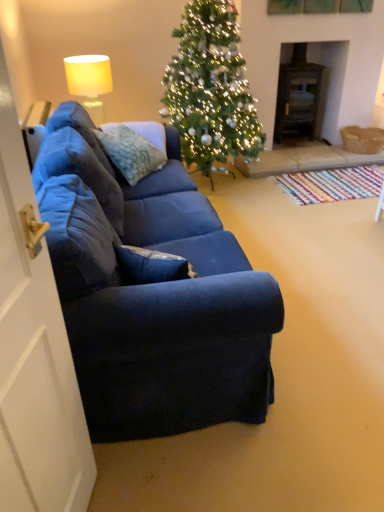
Identify the location of free location in front of green matte christmas tree at center. This screenshot has height=512, width=384. (272, 225).